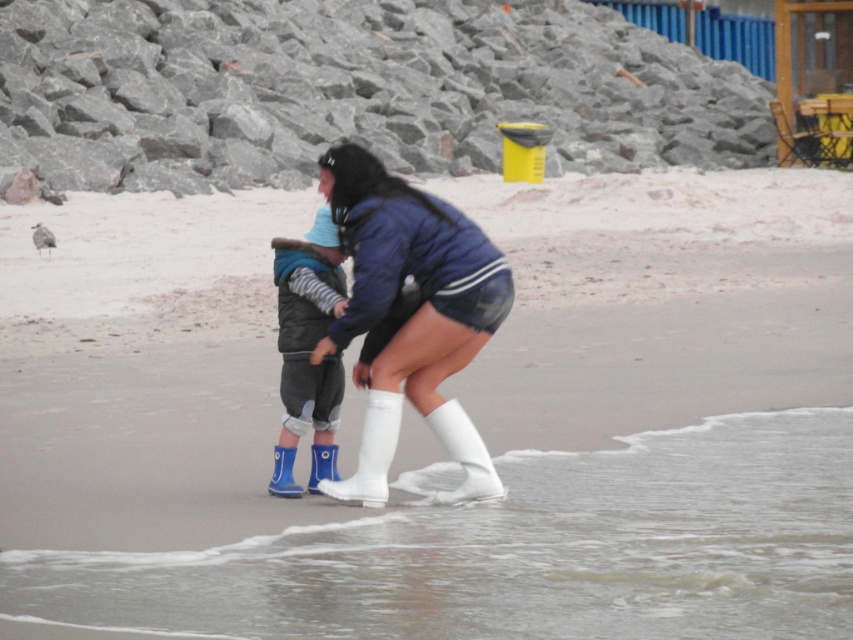
Can you confirm if smooth sand at lower center is positioned to the right of white matte socks at lower center?

No, smooth sand at lower center is not to the right of white matte socks at lower center.

Does smooth sand at lower center come behind white matte socks at lower center?

That is False.

Where is `smooth sand at lower center`? Image resolution: width=853 pixels, height=640 pixels. smooth sand at lower center is located at coordinates (143, 372).

Is the position of white rubber rain boot at center less distant than that of white matte socks at lower center?

Yes.

Can you confirm if white rubber rain boot at center is positioned above white matte socks at lower center?

Indeed, white rubber rain boot at center is positioned over white matte socks at lower center.

Identify the location of white rubber rain boot at center. (370, 452).

Between gray rock at upper center and rubber blue rain boot at lower center, which one is positioned higher?

Positioned higher is gray rock at upper center.

Identify the location of gray rock at upper center. The height and width of the screenshot is (640, 853). (354, 90).

In order to click on gray rock at upper center in this screenshot , I will do `click(354, 90)`.